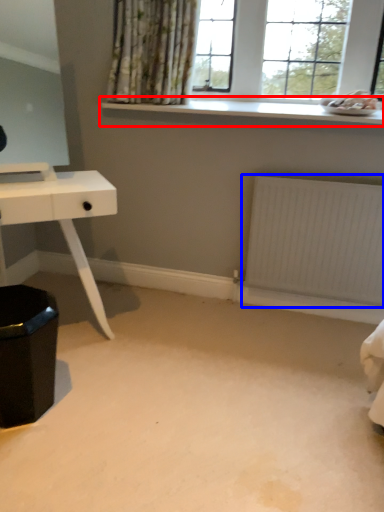
Question: Which object is further to the camera taking this photo, window sill (highlighted by a red box) or radiator (highlighted by a blue box)?

Choices:
 (A) window sill
 (B) radiator

Answer: (B)